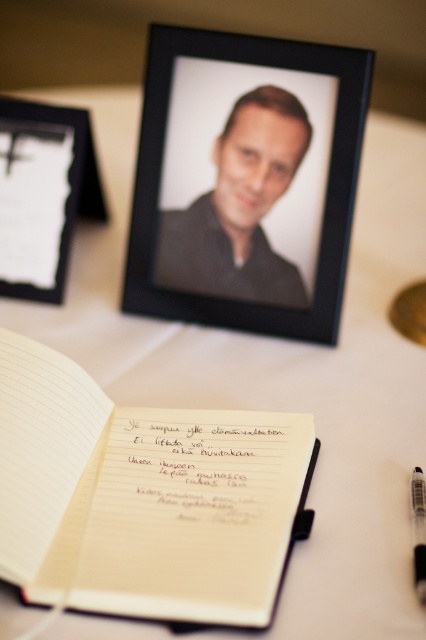
Does white paper notebook at center have a larger size compared to black plastic pen at lower right?

Yes.

Can you confirm if white paper notebook at center is thinner than black plastic pen at lower right?

In fact, white paper notebook at center might be wider than black plastic pen at lower right.

Is point (233, 531) farther from camera compared to point (411, 506)?

No, (233, 531) is in front of (411, 506).

I want to click on white paper notebook at center, so click(141, 497).

Which is above, white paper notebook at center or black matte picture frame at upper left?

black matte picture frame at upper left

Describe the element at coordinates (141, 497) in the screenshot. Image resolution: width=426 pixels, height=640 pixels. I see `white paper notebook at center` at that location.

Is point (58, 582) positioned behind point (89, 161)?

No, it is in front of (89, 161).

The width and height of the screenshot is (426, 640). In order to click on white paper notebook at center in this screenshot , I will do `click(141, 497)`.

Is brown paper notebook at center taller than black plastic pen at lower right?

Correct, brown paper notebook at center is much taller as black plastic pen at lower right.

Based on the photo, which is above, brown paper notebook at center or black plastic pen at lower right?

brown paper notebook at center is higher up.

Is point (215, 428) less distant than point (420, 561)?

No.

Locate an element on the screen. brown paper notebook at center is located at coordinates (206, 465).